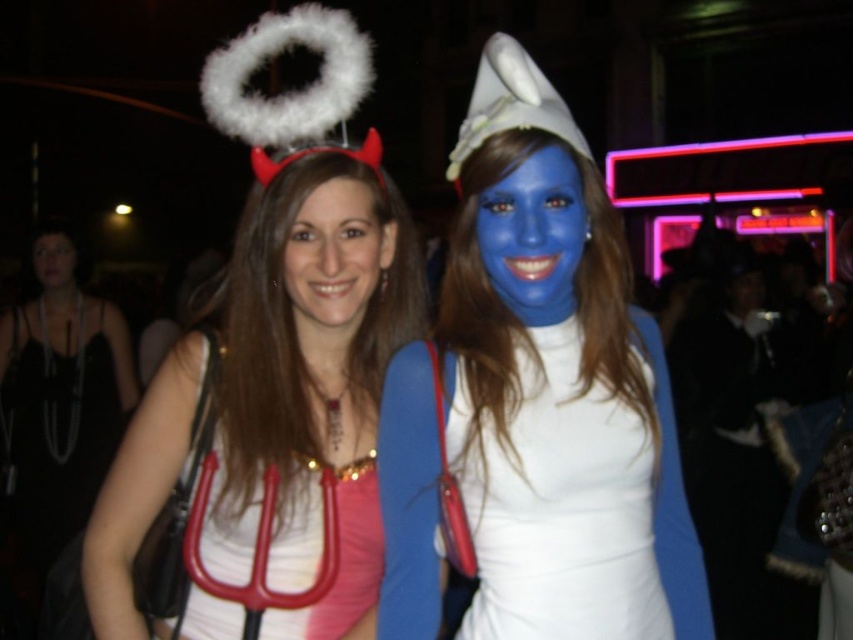
Looking at this image, can you confirm if white satin dress at center is wider than blue matte face at center?

Yes.

Based on the photo, can you confirm if white satin dress at center is shorter than blue matte face at center?

No, white satin dress at center is not shorter than blue matte face at center.

Where is `white satin dress at center`? white satin dress at center is located at coordinates (560, 506).

The width and height of the screenshot is (853, 640). In order to click on white satin dress at center in this screenshot , I will do `click(560, 506)`.

In the scene shown: Is white matte halo at upper center to the left of blue matte face at center from the viewer's perspective?

Indeed, white matte halo at upper center is positioned on the left side of blue matte face at center.

Find the location of `white matte halo at upper center`. white matte halo at upper center is located at coordinates (306, 352).

Identify the location of blue matte face at center. (534, 236).

Is blue matte face at center bigger than matte white face at center?

No.

Is point (567, 272) behind point (312, 250)?

No, it is not.

Locate an element on the screen. This screenshot has width=853, height=640. blue matte face at center is located at coordinates (534, 236).